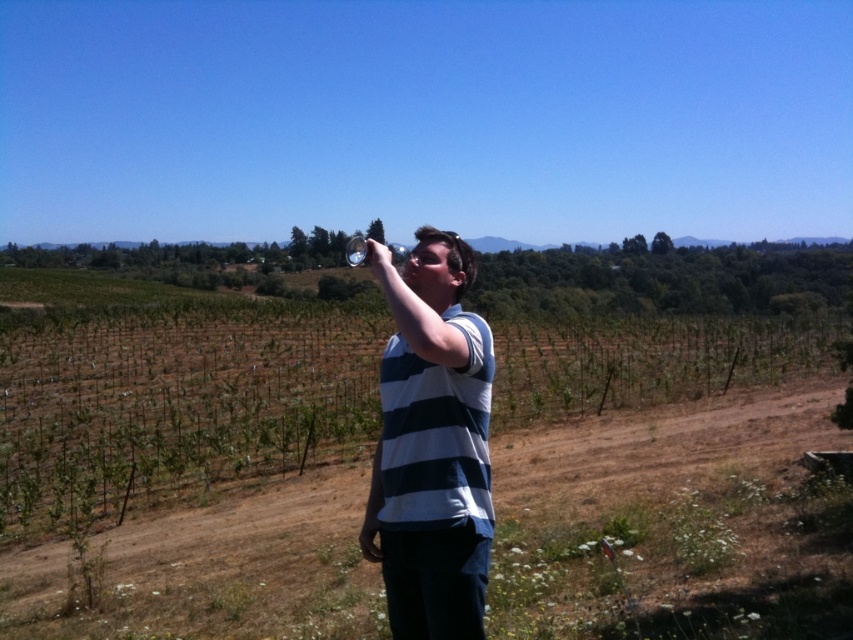
Question: Which object is closer to the camera taking this photo?

Choices:
 (A) white striped shirt at center
 (B) clear glass at upper center

Answer: (A)

Question: Can you confirm if white striped shirt at center is positioned to the right of clear glass at upper center?

Choices:
 (A) yes
 (B) no

Answer: (A)

Question: Can you confirm if white striped shirt at center is smaller than clear glass at upper center?

Choices:
 (A) no
 (B) yes

Answer: (B)

Question: Is white striped shirt at center further to camera compared to clear glass at upper center?

Choices:
 (A) yes
 (B) no

Answer: (B)